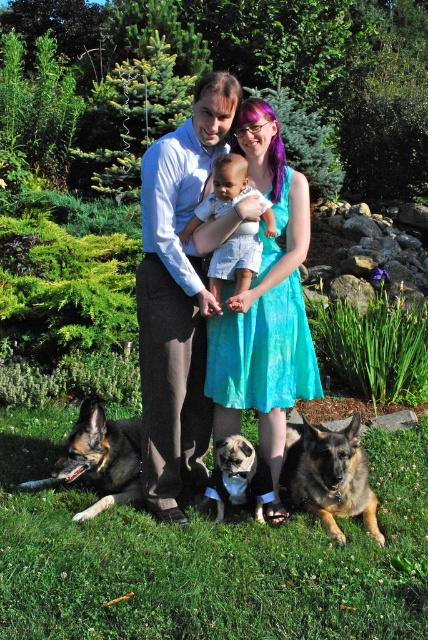
Can you confirm if green grass at center is wider than light blue shirt at center?

Yes, green grass at center is wider than light blue shirt at center.

Between point (315, 632) and point (154, 225), which one is positioned in front?

Point (315, 632)

Find the location of a particular element. green grass at center is located at coordinates (207, 557).

Where is `green grass at center`? green grass at center is located at coordinates click(207, 557).

Is light blue shirt at center to the left of brown fur dog at lower center from the viewer's perspective?

Indeed, light blue shirt at center is positioned on the left side of brown fur dog at lower center.

Between light blue shirt at center and brown fur dog at lower center, which one appears on the right side from the viewer's perspective?

brown fur dog at lower center

Between point (158, 276) and point (359, 472), which one is positioned behind?

The point (359, 472) is more distant.

I want to click on light blue shirt at center, so click(177, 300).

Can you confirm if turquoise fabric dress at center is positioned below dark brown fur at lower left?

Incorrect, turquoise fabric dress at center is not positioned below dark brown fur at lower left.

Is point (252, 333) closer to viewer compared to point (127, 442)?

That is True.

Does point (247, 355) come farther from viewer compared to point (94, 449)?

No, (247, 355) is closer to viewer.

Locate an element on the screen. The height and width of the screenshot is (640, 428). turquoise fabric dress at center is located at coordinates (262, 349).